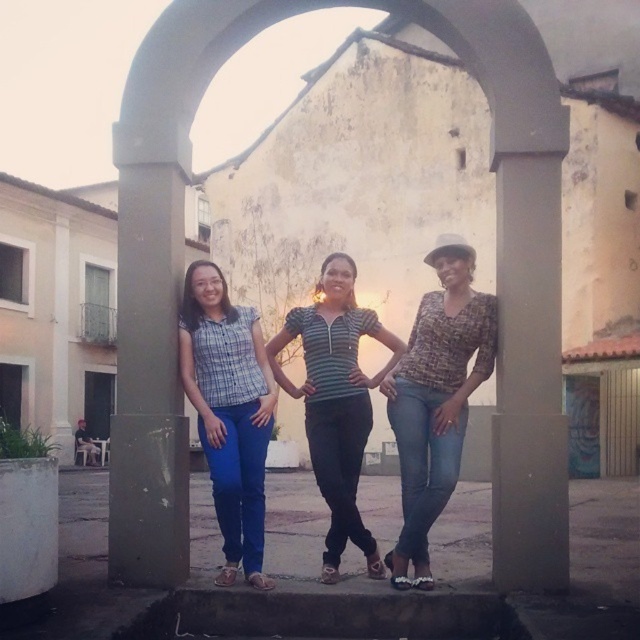
Question: Which point is closer to the camera taking this photo?

Choices:
 (A) (444, 289)
 (B) (353, 417)
 (C) (348, 628)
 (D) (257, 460)

Answer: (C)

Question: Considering the relative positions of concrete at center and blue jeans at center in the image provided, where is concrete at center located with respect to blue jeans at center?

Choices:
 (A) right
 (B) left

Answer: (B)

Question: In this image, where is concrete at center located relative to blue jeans at center?

Choices:
 (A) above
 (B) below

Answer: (A)

Question: Which of the following is the closest to the observer?

Choices:
 (A) blue denim jeans at center
 (B) printed fabric blouse at center

Answer: (B)

Question: Which of the following is the farthest from the observer?

Choices:
 (A) blue denim jeans at center
 (B) printed fabric blouse at center
 (C) blue jeans at center
 (D) striped fabric shirt at center

Answer: (D)

Question: Does concrete at center appear over printed fabric blouse at center?

Choices:
 (A) yes
 (B) no

Answer: (A)